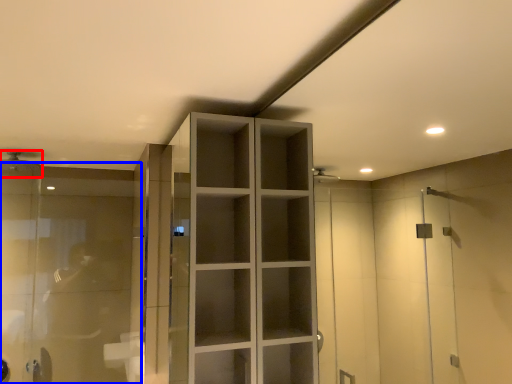
Question: Which object appears closest to the camera in this image, shower (highlighted by a red box) or glass door (highlighted by a blue box)?

Choices:
 (A) shower
 (B) glass door

Answer: (B)